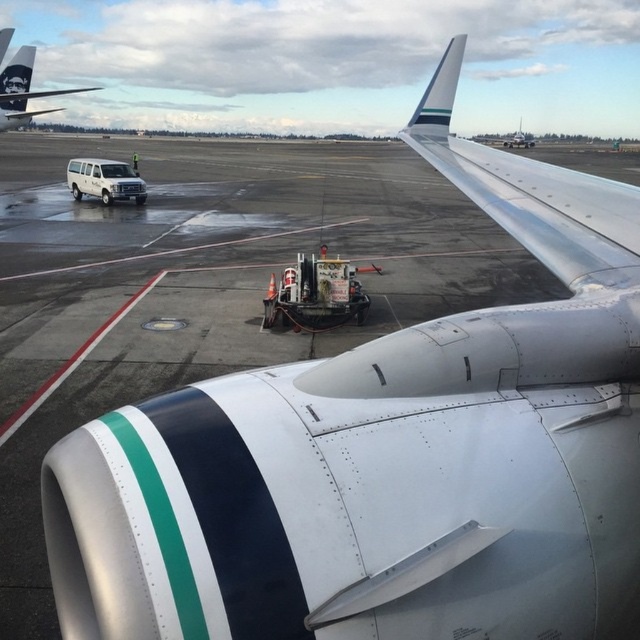
Based on the photo, does silver metallic wing at upper right appear on the left side of white matte van at left?

In fact, silver metallic wing at upper right is to the right of white matte van at left.

Who is more forward, (560, 177) or (120, 180)?

Point (560, 177) is more forward.

What do you see at coordinates (531, 193) in the screenshot?
I see `silver metallic wing at upper right` at bounding box center [531, 193].

The width and height of the screenshot is (640, 640). Find the location of `silver metallic wing at upper right`. silver metallic wing at upper right is located at coordinates (531, 193).

Does silver metallic wing at upper right have a greater width compared to matte black airplane at upper left?

No, silver metallic wing at upper right is not wider than matte black airplane at upper left.

What do you see at coordinates (531, 193) in the screenshot?
I see `silver metallic wing at upper right` at bounding box center [531, 193].

Which is behind, point (474, 172) or point (3, 76)?

Positioned behind is point (3, 76).

Find the location of `silver metallic wing at upper right`. silver metallic wing at upper right is located at coordinates (531, 193).

Is point (19, 54) farther from camera compared to point (129, 186)?

That is True.

Does matte black airplane at upper left appear under white matte van at left?

Actually, matte black airplane at upper left is above white matte van at left.

You are a GUI agent. You are given a task and a screenshot of the screen. Output one action in this format:
    pyautogui.click(x=<x>, y=<y>)
    Task: Click on the matte black airplane at upper left
    Image resolution: width=640 pixels, height=640 pixels.
    Given the screenshot: What is the action you would take?
    pyautogui.click(x=22, y=90)

Find the location of a particular element. This screenshot has height=640, width=640. matte black airplane at upper left is located at coordinates (22, 90).